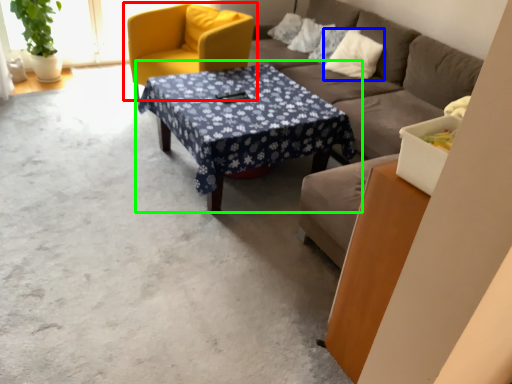
Question: Considering the real-world distances, which object is closest to chair (highlighted by a red box)? pillow (highlighted by a blue box) or coffee table (highlighted by a green box).

Choices:
 (A) pillow
 (B) coffee table

Answer: (B)